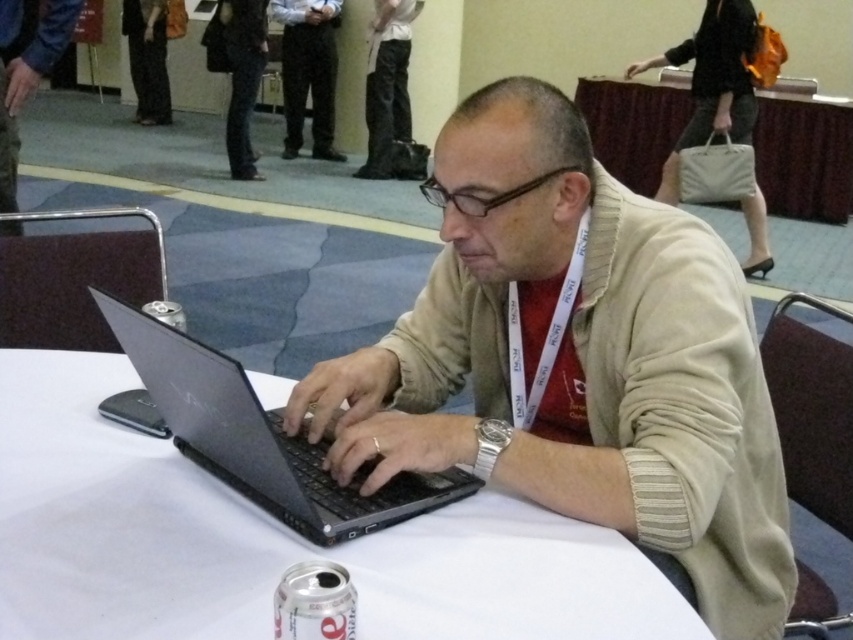
Question: Which of the following is the farthest from the observer?

Choices:
 (A) (323, 33)
 (B) (711, 621)
 (C) (474, 506)
 (D) (15, 141)

Answer: (A)

Question: Which point is closer to the camera?

Choices:
 (A) (656, 90)
 (B) (294, 76)
 (C) (428, 522)
 (D) (463, 188)

Answer: (C)

Question: Does white cloth table at center have a lesser width compared to white fabric table at upper center?

Choices:
 (A) yes
 (B) no

Answer: (B)

Question: Which of the following is the closest to the observer?

Choices:
 (A) (267, 483)
 (B) (851, 124)

Answer: (A)

Question: Where is white fabric table at upper center located in relation to matte black laptop at left in the image?

Choices:
 (A) left
 (B) right

Answer: (B)

Question: Observing the image, what is the correct spatial positioning of matte black laptop at left in reference to dark gray pants at center?

Choices:
 (A) below
 (B) above

Answer: (A)